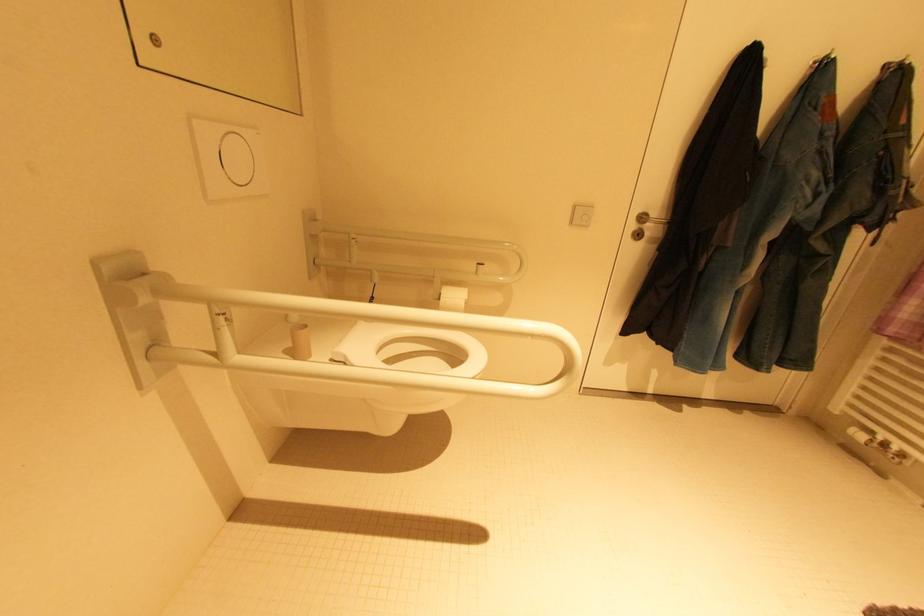
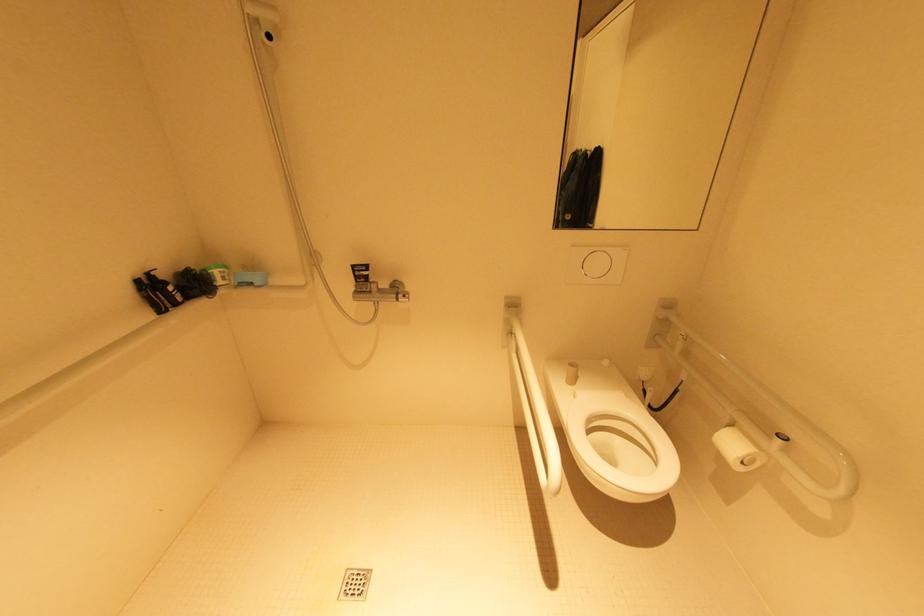
How did the camera likely rotate?

The camera rotated toward left-down.